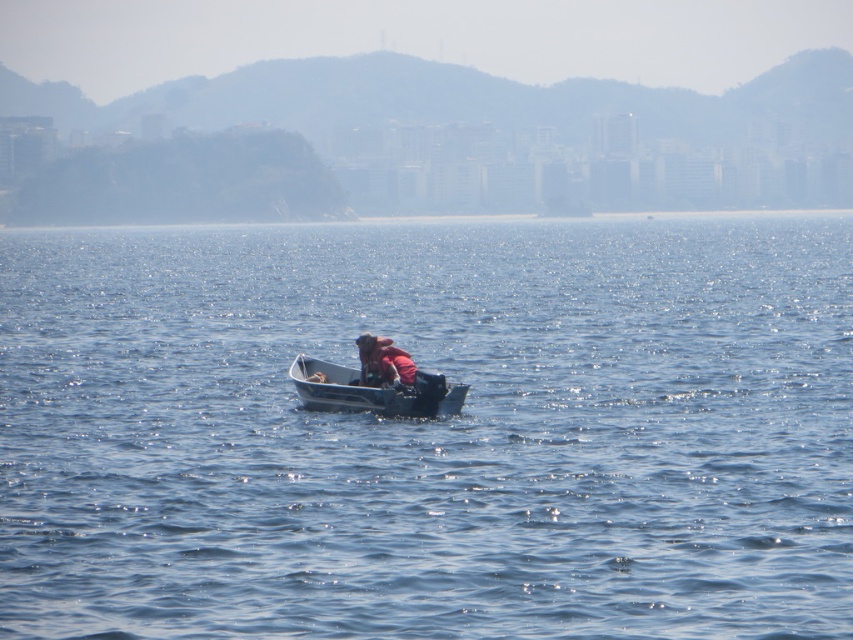
You are navigating a small boat and need to determine the order of two points on your radar screen. The points are labeled as point (357, 387) and point (393, 372). Based on their positions, which point is closer to your boat?

Point (393, 372) is closer to the boat because it is in front of point (357, 387), which is behind it.

You are a photographer trying to capture a wide shot of the metallic gray canoe at center and the pink fabric at center. Your camera has a maximum focus range of 1.2 meters. Can you fit both objects into the frame without moving the camera?

The metallic gray canoe at center and pink fabric at center are 1.21 meters apart, so the distance between them exceeds the camera focus range of 1.2 meters. Therefore, you cannot fit both objects into the frame without moving the camera.

From the picture: You are planning to place a small floating dock in the image. The dock must be placed where the blue water at center and pink fabric at center are located. Which location allows for a wider dock without overlapping the other object?

The blue water at center has a larger width than the pink fabric at center, so placing the dock at the blue water at center allows for a wider dock without overlapping the pink fabric at center.